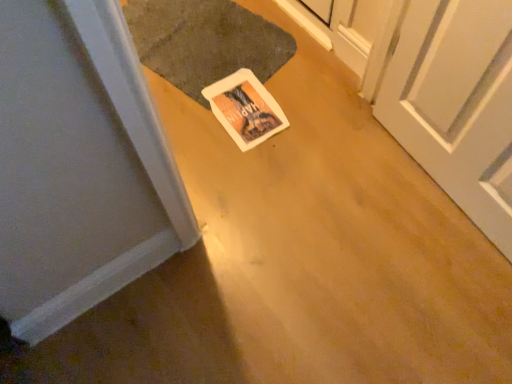
Find the location of a particular element. free space to the back side of white paper postcard at center is located at coordinates (248, 58).